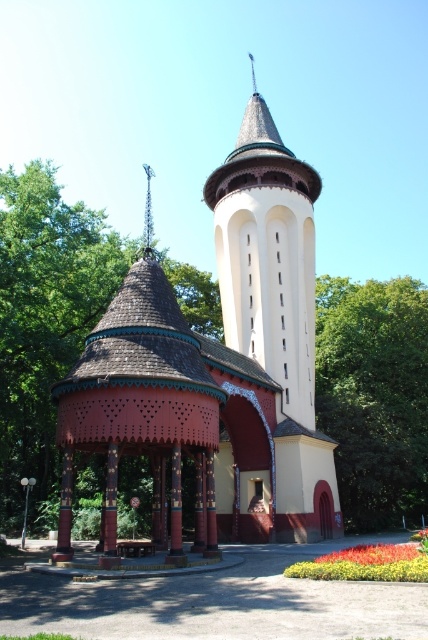
Question: Which object is the closest to the brown wooden gazebo at left?

Choices:
 (A) green leafy tree at upper center
 (B) white smooth tower at center

Answer: (B)

Question: Is brown wooden gazebo at left to the right of green leafy tree at upper center from the viewer's perspective?

Choices:
 (A) yes
 (B) no

Answer: (B)

Question: Does green leafy tree at upper center lie in front of white smooth tower at center?

Choices:
 (A) yes
 (B) no

Answer: (B)

Question: Which object is the closest to the green leafy tree at upper center?

Choices:
 (A) brown wooden gazebo at left
 (B) white smooth tower at center

Answer: (B)

Question: Can you confirm if brown wooden gazebo at left is bigger than green leafy tree at upper center?

Choices:
 (A) yes
 (B) no

Answer: (A)

Question: Which object is the closest to the green leafy tree at upper center?

Choices:
 (A) white smooth tower at center
 (B) brown wooden gazebo at left

Answer: (A)